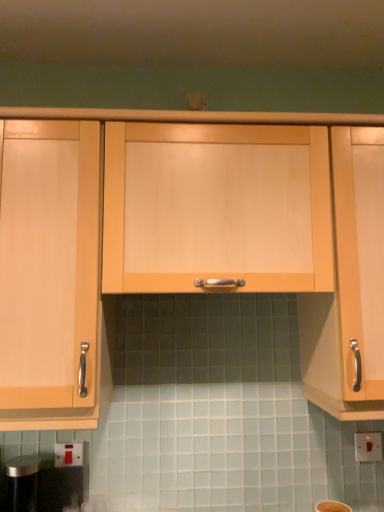
Question: From the image's perspective, does light wood cabinet handle at right, the 1th cabinetry in the right-to-left sequence, appear higher than matte white electric outlet at lower left, the first electric outlet in the front-to-back sequence?

Choices:
 (A) yes
 (B) no

Answer: (A)

Question: Considering the relative positions of light wood cabinet handle at right, the 1th cabinetry in the right-to-left sequence, and matte white electric outlet at lower left, placed as the second electric outlet when sorted from right to left, in the image provided, is light wood cabinet handle at right, the 1th cabinetry in the right-to-left sequence, to the right of matte white electric outlet at lower left, placed as the second electric outlet when sorted from right to left, from the viewer's perspective?

Choices:
 (A) yes
 (B) no

Answer: (A)

Question: Would you consider light wood cabinet handle at right, the 1th cabinetry in the right-to-left sequence, to be distant from matte white electric outlet at lower left, placed as the second electric outlet when sorted from right to left?

Choices:
 (A) no
 (B) yes

Answer: (A)

Question: Is light wood cabinet handle at right, the 1th cabinetry in the right-to-left sequence, next to matte white electric outlet at lower left, placed as the second electric outlet when sorted from right to left?

Choices:
 (A) no
 (B) yes

Answer: (A)

Question: From the image's perspective, is light wood cabinet handle at right, arranged as the 3th cabinetry when viewed from the left, located beneath matte white electric outlet at lower left, which is the second electric outlet from back to front?

Choices:
 (A) yes
 (B) no

Answer: (B)

Question: Would you say light wood cabinet handle at right, the 1th cabinetry in the right-to-left sequence, is to the left or to the right of white plastic switch at lower right, positioned as the 1th electric outlet in back-to-front order, in the picture?

Choices:
 (A) left
 (B) right

Answer: (A)

Question: Is light wood cabinet handle at right, arranged as the 3th cabinetry when viewed from the left, situated inside white plastic switch at lower right, which is the second electric outlet in left-to-right order, or outside?

Choices:
 (A) outside
 (B) inside

Answer: (A)

Question: From their relative heights in the image, would you say light wood cabinet handle at right, the 1th cabinetry in the right-to-left sequence, is taller or shorter than white plastic switch at lower right, positioned as the 1th electric outlet in back-to-front order?

Choices:
 (A) short
 (B) tall

Answer: (B)

Question: From the image's perspective, is light wood cabinet handle at right, arranged as the 3th cabinetry when viewed from the left, above or below white plastic switch at lower right, positioned as the 1th electric outlet in back-to-front order?

Choices:
 (A) below
 (B) above

Answer: (B)

Question: Is white plastic switch at lower right, positioned as the 1th electric outlet in back-to-front order, wider or thinner than matte white electric outlet at lower left, the first electric outlet in the front-to-back sequence?

Choices:
 (A) wide
 (B) thin

Answer: (B)

Question: Does point (355, 452) appear closer or farther from the camera than point (61, 452)?

Choices:
 (A) farther
 (B) closer

Answer: (A)

Question: Considering their positions, is white plastic switch at lower right, the 2th electric outlet in the front-to-back sequence, located in front of or behind matte white electric outlet at lower left, placed as the second electric outlet when sorted from right to left?

Choices:
 (A) front
 (B) behind

Answer: (B)

Question: In the image, is white plastic switch at lower right, which is the second electric outlet in left-to-right order, on the left side or the right side of matte white electric outlet at lower left, which is the 1th electric outlet in left-to-right order?

Choices:
 (A) left
 (B) right

Answer: (B)

Question: Does point (38, 125) appear closer or farther from the camera than point (382, 290)?

Choices:
 (A) farther
 (B) closer

Answer: (A)

Question: From a real-world perspective, is light wood cabinet at left, the 1th cabinetry when ordered from left to right, positioned above or below light wood cabinet handle at right, the 1th cabinetry in the right-to-left sequence?

Choices:
 (A) below
 (B) above

Answer: (A)